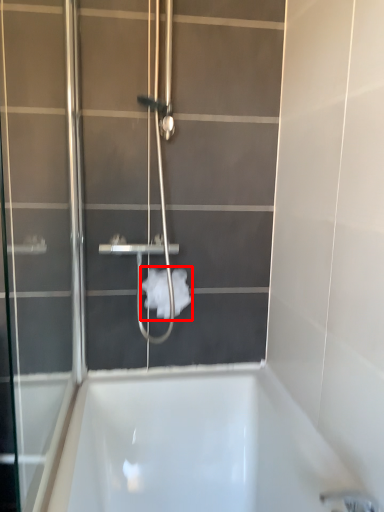
Question: In this image, where is toilet paper (annotated by the red box) located relative to screen door?

Choices:
 (A) right
 (B) left

Answer: (A)